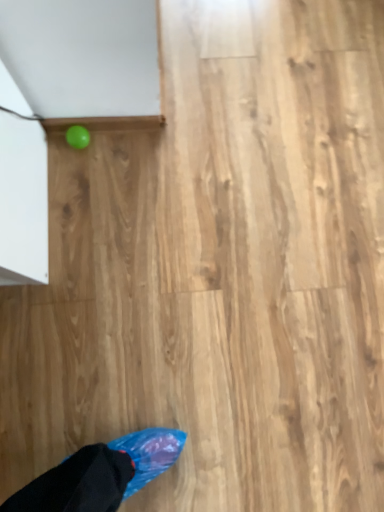
Consider the image. Measure the distance between point (88, 135) and camera.

3.71 feet.

This screenshot has width=384, height=512. I want to click on green rubber ball at upper left, so click(x=78, y=136).

The width and height of the screenshot is (384, 512). What do you see at coordinates (78, 136) in the screenshot?
I see `green rubber ball at upper left` at bounding box center [78, 136].

Locate an element on the screen. green rubber ball at upper left is located at coordinates (78, 136).